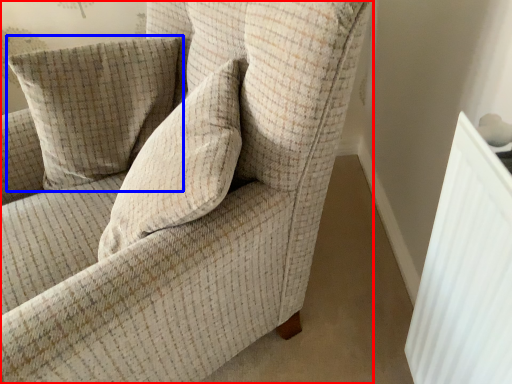
Question: Which point is further to the camera, chair (highlighted by a red box) or pillow (highlighted by a blue box)?

Choices:
 (A) chair
 (B) pillow

Answer: (B)